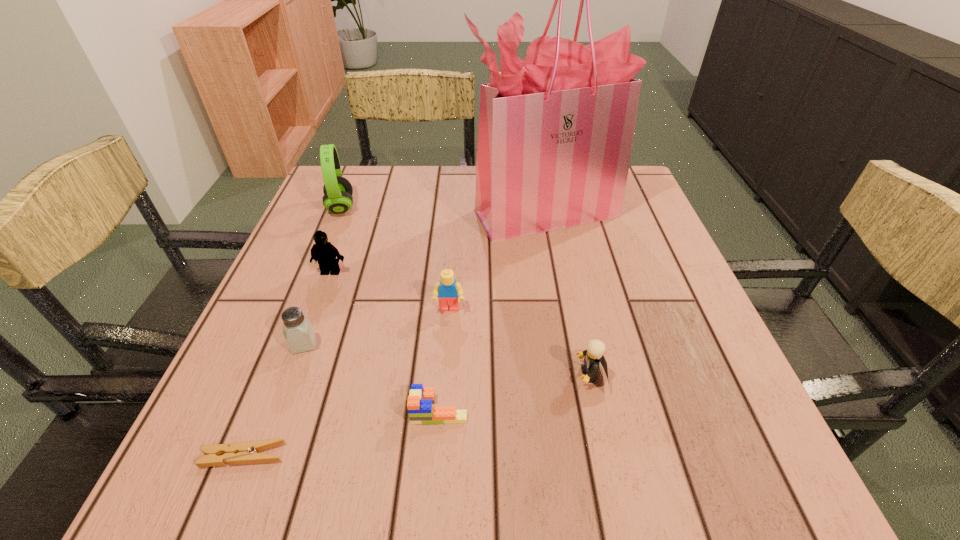
Where is `shopping bag present at the far edge`? Image resolution: width=960 pixels, height=540 pixels. shopping bag present at the far edge is located at coordinates (555, 135).

You are a GUI agent. You are given a task and a screenshot of the screen. Output one action in this format:
    pyautogui.click(x=<x>, y=<y>)
    Task: Click on the headset located in the far edge section of the desktop
    This screenshot has height=540, width=960.
    Given the screenshot: What is the action you would take?
    [x=337, y=190]

Locate an element on the screen. object situated at the near edge is located at coordinates (245, 452).

Where is `headset at the left edge`? Image resolution: width=960 pixels, height=540 pixels. headset at the left edge is located at coordinates (337, 190).

Locate an element on the screen. The image size is (960, 540). Lego that is at the left edge is located at coordinates (324, 252).

Identify the location of saltshaker that is at the left edge. This screenshot has height=540, width=960. (298, 331).

The width and height of the screenshot is (960, 540). I want to click on clothespin positioned at the left edge, so click(x=245, y=452).

This screenshot has height=540, width=960. I want to click on object that is at the right edge, so coord(555,135).

Locate an element on the screen. The width and height of the screenshot is (960, 540). object located in the far left corner section of the desktop is located at coordinates (337, 190).

This screenshot has width=960, height=540. I want to click on object that is at the near left corner, so click(245, 452).